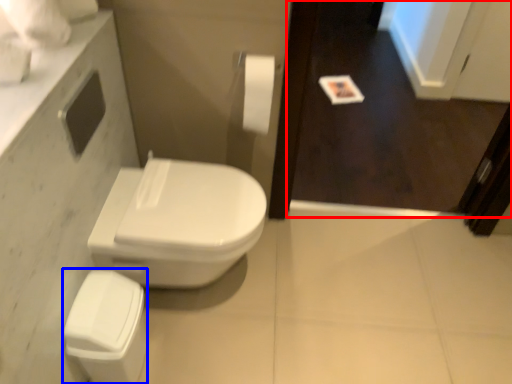
Question: Which point is closer to the camera, screen door (highlighted by a red box) or porcelain (highlighted by a blue box)?

Choices:
 (A) screen door
 (B) porcelain

Answer: (B)